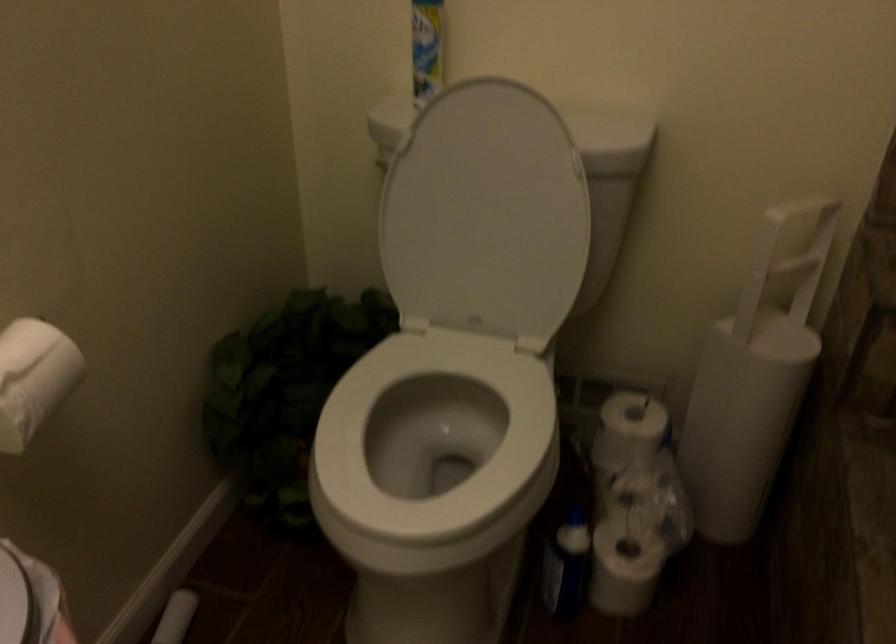
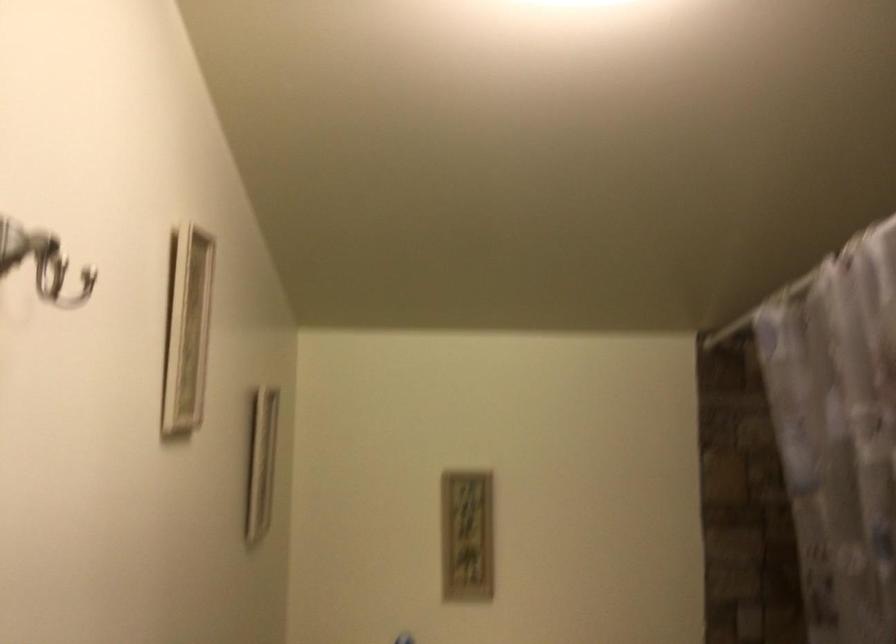
In the scene shown: How did the camera likely rotate?

The camera rotated toward right-up.